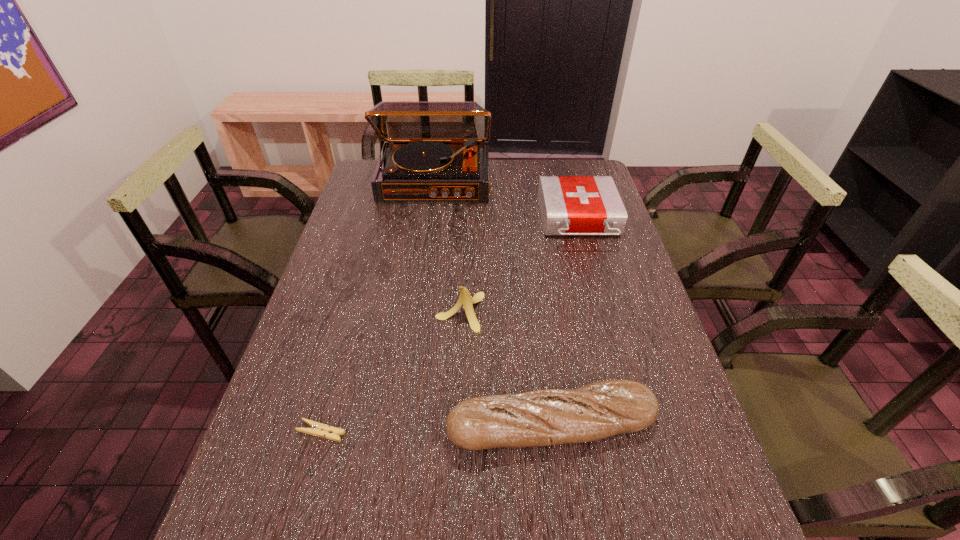
This screenshot has width=960, height=540. Identify the location of free space between the baguet and the record player. (493, 303).

The height and width of the screenshot is (540, 960). I want to click on empty space that is in between the record player and the third nearest object, so click(447, 247).

Image resolution: width=960 pixels, height=540 pixels. Identify the location of free area in between the first-aid kit and the banana. (519, 266).

The width and height of the screenshot is (960, 540). What are the coordinates of `vacant area between the fourth shortest object and the clothespin` in the screenshot? It's located at (391, 372).

At what (x,y) coordinates should I click in order to perform the action: click on empty location between the baguet and the shortest object. Please return your answer as a coordinate pair (x, y). Looking at the image, I should click on (437, 428).

At what (x,y) coordinates should I click in order to perform the action: click on unoccupied position between the shortest object and the third farthest object. Please return your answer as a coordinate pair (x, y). Looking at the image, I should click on (391, 372).

Find the location of a particular element. This screenshot has height=540, width=960. free spot between the first-aid kit and the banana is located at coordinates (519, 266).

Where is `vacant area between the baguet and the shortest object`? The width and height of the screenshot is (960, 540). vacant area between the baguet and the shortest object is located at coordinates (437, 428).

The image size is (960, 540). I want to click on free spot between the third farthest object and the record player, so click(x=447, y=247).

Identify the location of vacant space in between the third farthest object and the tallest object. (447, 247).